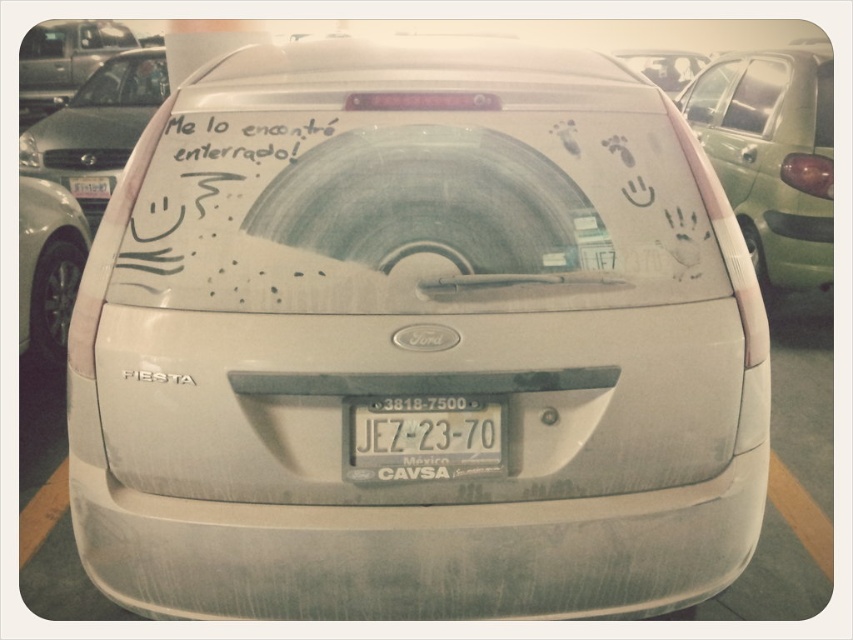
You are a delivery person trying to deliver a package to the white matte car at upper center. You see a white matte surfboard at upper left blocking your path. Can you reach the car without moving the surfboard?

The white matte surfboard at upper left is closer to the viewer than the white matte car at upper center, so you can reach the car without moving the surfboard because it is behind the surfboard.

Consider the image. You are a driver who just noticed the white plastic license plate at center and the white matte car at upper center in your rearview mirror. Which object appears larger in your view?

The white matte car at upper center appears larger than the white plastic license plate at center because the license plate is smaller.

You are a delivery driver who needs to attach a GPS tracker to the white plastic license plate at center of the white matte car at upper center. However, the GPS tracker you have is only compatible with license plates that are at least as long as the car itself. Can you attach the tracker to the license plate?

The white plastic license plate at center is shorter than the white matte car at upper center, so the GPS tracker cannot be attached because it requires the license plate to be at least as long as the car.